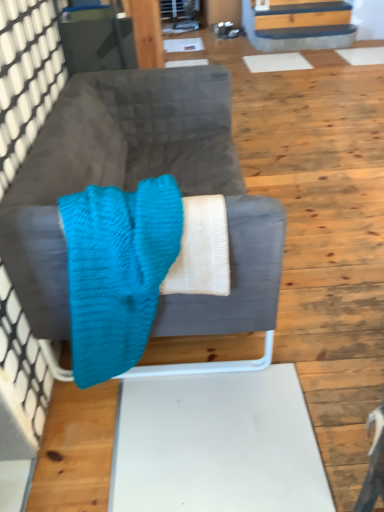
Question: Does turquoise knitted blanket at center have a greater width compared to velvet gray couch at center?

Choices:
 (A) no
 (B) yes

Answer: (A)

Question: Is turquoise knitted blanket at center taller than velvet gray couch at center?

Choices:
 (A) no
 (B) yes

Answer: (A)

Question: Is turquoise knitted blanket at center completely or partially outside of velvet gray couch at center?

Choices:
 (A) no
 (B) yes

Answer: (A)

Question: Is turquoise knitted blanket at center facing towards velvet gray couch at center?

Choices:
 (A) yes
 (B) no

Answer: (A)

Question: From a real-world perspective, is turquoise knitted blanket at center physically below velvet gray couch at center?

Choices:
 (A) yes
 (B) no

Answer: (B)

Question: Can you confirm if turquoise knitted blanket at center is positioned to the left of velvet gray couch at center?

Choices:
 (A) no
 (B) yes

Answer: (B)

Question: Can you confirm if velvet gray couch at center is wider than turquoise knitted blanket at center?

Choices:
 (A) no
 (B) yes

Answer: (B)

Question: Is velvet gray couch at center facing away from turquoise knitted blanket at center?

Choices:
 (A) no
 (B) yes

Answer: (A)

Question: From a real-world perspective, is velvet gray couch at center physically below turquoise knitted blanket at center?

Choices:
 (A) no
 (B) yes

Answer: (B)

Question: Would you say velvet gray couch at center is outside turquoise knitted blanket at center?

Choices:
 (A) yes
 (B) no

Answer: (A)

Question: Does velvet gray couch at center appear on the right side of turquoise knitted blanket at center?

Choices:
 (A) no
 (B) yes

Answer: (B)

Question: Is velvet gray couch at center thinner than turquoise knitted blanket at center?

Choices:
 (A) yes
 (B) no

Answer: (B)

Question: Is velvet gray couch at center bigger or smaller than turquoise knitted blanket at center?

Choices:
 (A) big
 (B) small

Answer: (A)